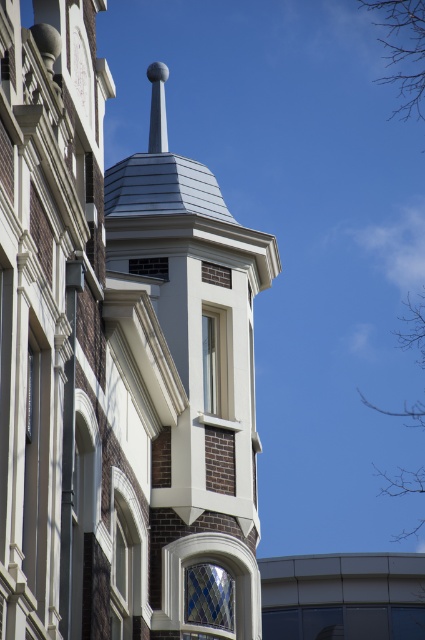
You are standing in front of the building and notice a point marked at coordinates (190, 372). What architectural feature does this point most likely indicate?

The point at coordinates (190, 372) corresponds to the white smooth tower at center.